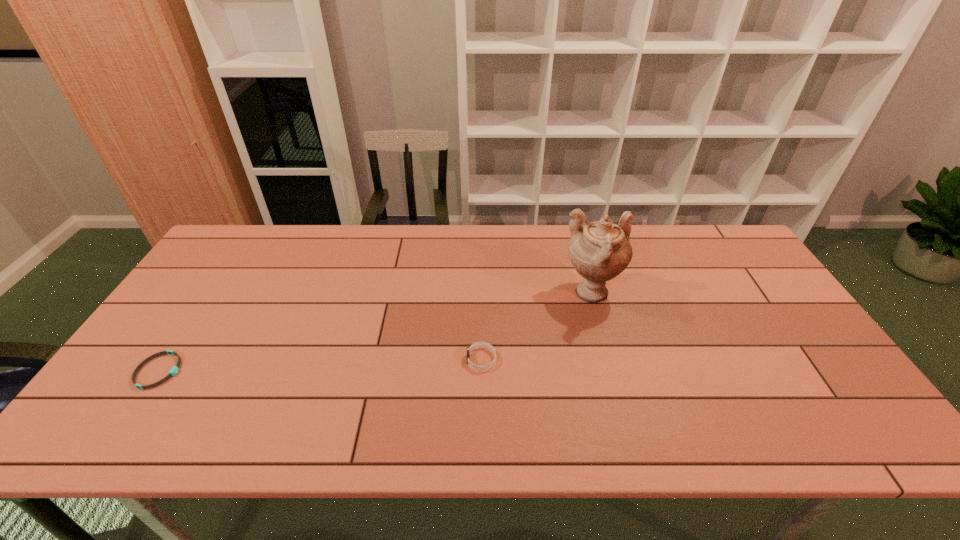
Where is `free location located 0.110m on the buckle of the leftmost object`? free location located 0.110m on the buckle of the leftmost object is located at coordinates (224, 371).

What are the coordinates of `object that is positioned at the left edge` in the screenshot? It's located at (174, 370).

The image size is (960, 540). In the image, there is a desktop. Identify the location of free region at the far edge. (567, 241).

The height and width of the screenshot is (540, 960). Identify the location of free space at the near edge. (496, 417).

Identify the location of free point at the left edge. Image resolution: width=960 pixels, height=540 pixels. (177, 307).

Locate an element on the screen. This screenshot has width=960, height=540. free space at the far right corner is located at coordinates (738, 250).

What are the coordinates of `free space between the leftmost object and the right wristband` in the screenshot? It's located at (321, 365).

Locate an element on the screen. This screenshot has width=960, height=540. free space between the second tallest object and the rightmost object is located at coordinates (537, 327).

Locate an element on the screen. This screenshot has height=540, width=960. blank region between the right wristband and the farthest object is located at coordinates (537, 327).

Identify the location of empty space between the shortest object and the farthest object. The height and width of the screenshot is (540, 960). (375, 333).